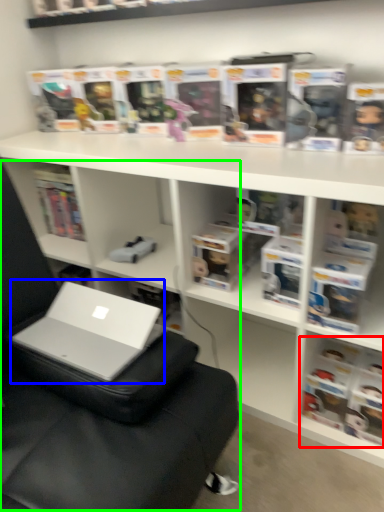
Question: Based on their relative distances, which object is nearer to book (highlighted by a red box)? Choose from laptop (highlighted by a blue box) and bean bag chair (highlighted by a green box).

Choices:
 (A) laptop
 (B) bean bag chair

Answer: (B)